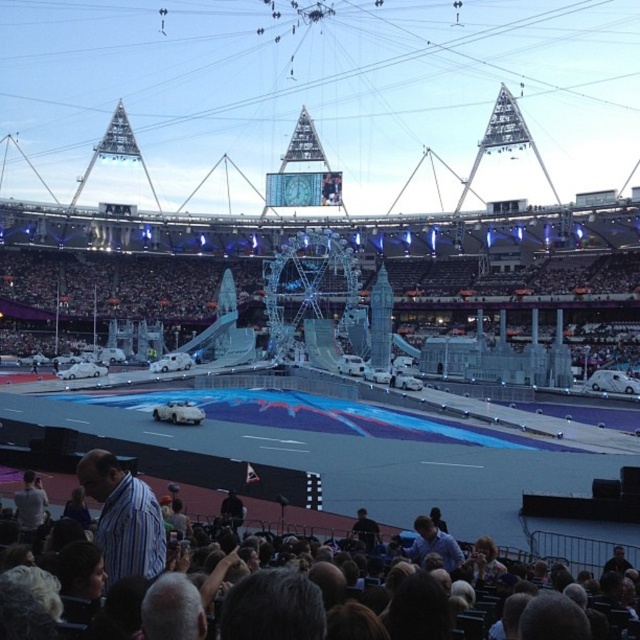
Between dark hair at lower center and striped cotton shirt at lower left, which one is positioned lower?

dark hair at lower center is below.

What do you see at coordinates (336, 604) in the screenshot?
I see `dark hair at lower center` at bounding box center [336, 604].

The image size is (640, 640). What are the coordinates of `dark hair at lower center` in the screenshot? It's located at (336, 604).